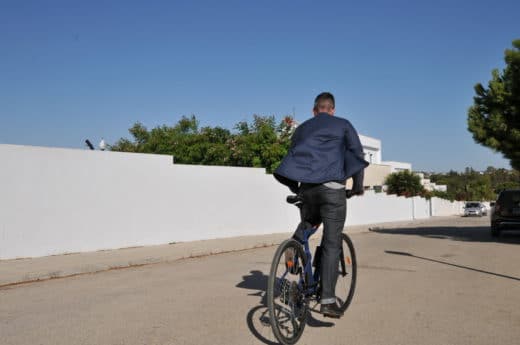
The image size is (520, 345). Find the location of `concrete wall`. concrete wall is located at coordinates (91, 197), (253, 202), (355, 210), (398, 209), (441, 207).